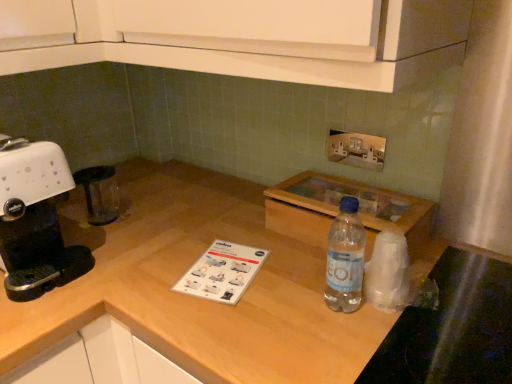
Question: Is metallic silver outlet at upper center turned away from transparent plastic bag at right?

Choices:
 (A) yes
 (B) no

Answer: (B)

Question: Is metallic silver outlet at upper center positioned behind transparent plastic bag at right?

Choices:
 (A) no
 (B) yes

Answer: (B)

Question: Are metallic silver outlet at upper center and transparent plastic bag at right making contact?

Choices:
 (A) yes
 (B) no

Answer: (B)

Question: Would you say transparent plastic bag at right is part of metallic silver outlet at upper center's contents?

Choices:
 (A) no
 (B) yes

Answer: (A)

Question: From a real-world perspective, does metallic silver outlet at upper center stand above transparent plastic bag at right?

Choices:
 (A) yes
 (B) no

Answer: (A)

Question: Do you think wooden at center is within metallic silver outlet at upper center, or outside of it?

Choices:
 (A) inside
 (B) outside

Answer: (B)

Question: From their relative heights in the image, would you say wooden at center is taller or shorter than metallic silver outlet at upper center?

Choices:
 (A) short
 (B) tall

Answer: (B)

Question: Would you say wooden at center is to the left or to the right of metallic silver outlet at upper center in the picture?

Choices:
 (A) right
 (B) left

Answer: (B)

Question: Is point (95, 256) positioned closer to the camera than point (329, 134)?

Choices:
 (A) closer
 (B) farther

Answer: (A)

Question: Is point (30, 200) positioned closer to the camera than point (128, 167)?

Choices:
 (A) farther
 (B) closer

Answer: (B)

Question: Considering their positions, is white plastic coffee machine at left located in front of or behind wooden at center?

Choices:
 (A) front
 (B) behind

Answer: (B)

Question: Considering the positions of white plastic coffee machine at left and wooden at center in the image, is white plastic coffee machine at left taller or shorter than wooden at center?

Choices:
 (A) short
 (B) tall

Answer: (A)

Question: From the image's perspective, is white plastic coffee machine at left above or below wooden at center?

Choices:
 (A) below
 (B) above

Answer: (B)

Question: Looking at the image, does white plastic coffee machine at left seem bigger or smaller compared to transparent plastic bag at right?

Choices:
 (A) big
 (B) small

Answer: (A)

Question: From a real-world perspective, relative to transparent plastic bag at right, is white plastic coffee machine at left vertically above or below?

Choices:
 (A) below
 (B) above

Answer: (B)